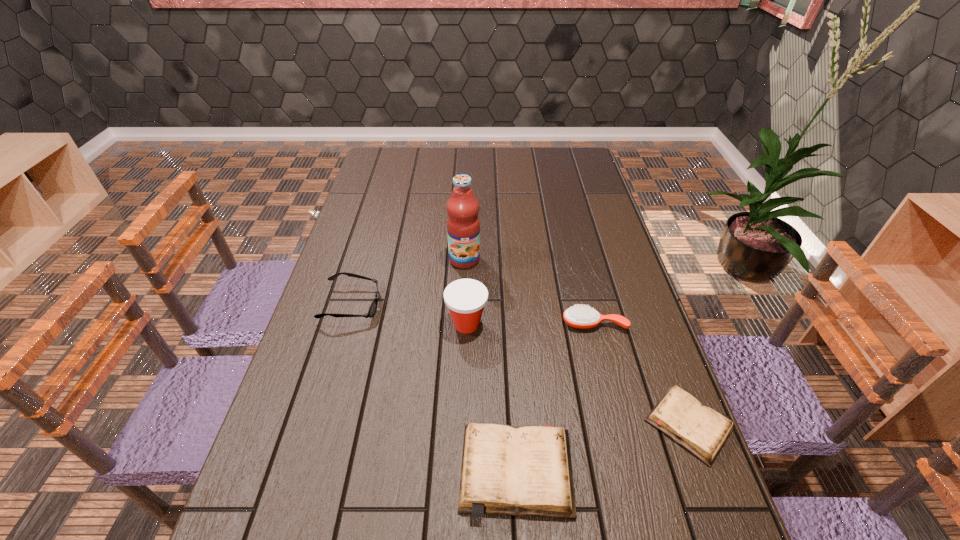
You are a GUI agent. You are given a task and a screenshot of the screen. Output one action in this format:
    pyautogui.click(x=<x>, y=<y>)
    Task: Click on the vacant point at the near edge
    
    Given the screenshot: What is the action you would take?
    pyautogui.click(x=441, y=524)

In the image, there is a desktop. Where is `vacant space at the left edge`? vacant space at the left edge is located at coordinates (339, 381).

This screenshot has width=960, height=540. In order to click on vacant area at the right edge in this screenshot , I will do `click(599, 359)`.

The height and width of the screenshot is (540, 960). Find the location of `free spot at the far left corner of the desktop`. free spot at the far left corner of the desktop is located at coordinates (388, 149).

In the image, there is a desktop. Identify the location of vacant space at the near left corner. (260, 516).

Identify the location of vacant region at the far right corner of the desktop. The height and width of the screenshot is (540, 960). (564, 158).

Where is `free spot between the second shortest object and the tallest object`? This screenshot has width=960, height=540. free spot between the second shortest object and the tallest object is located at coordinates (491, 365).

In order to click on empty space between the hairbrush and the left diary in this screenshot , I will do `click(555, 397)`.

You are a GUI agent. You are given a task and a screenshot of the screen. Output one action in this format:
    pyautogui.click(x=<x>, y=<y>)
    Task: Click on the unoccupied area between the second shortest object and the hairbrush
    The image size is (960, 540).
    Given the screenshot: What is the action you would take?
    pyautogui.click(x=555, y=397)

Locate an element on the screen. The height and width of the screenshot is (540, 960). vacant space that is in between the hairbrush and the fruit juice is located at coordinates (529, 292).